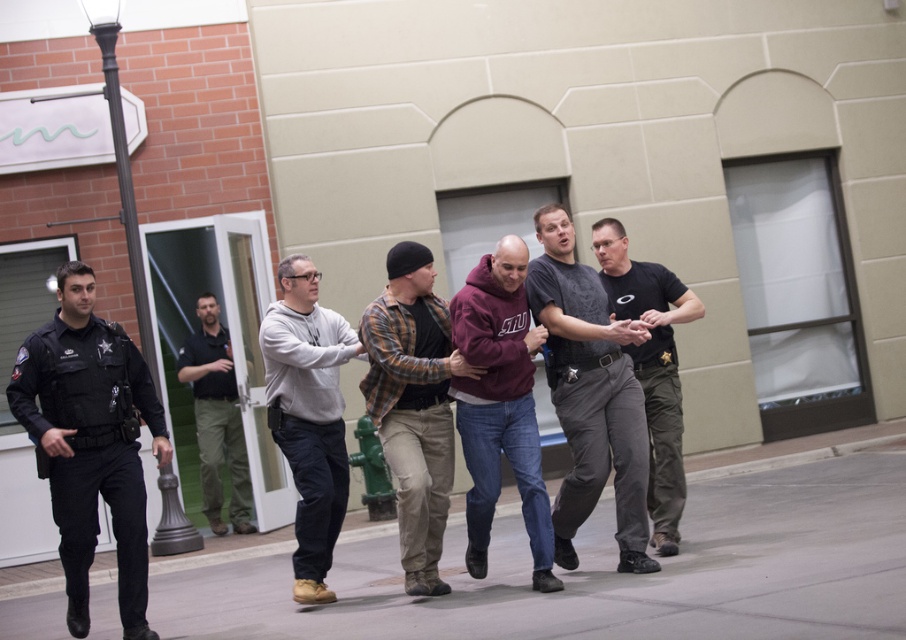
You are a security guard observing the scene outside the modern building. You notice the black uniformed officer at left and the black uniform pants at center. Which one is positioned lower in the image?

The black uniformed officer at left is located below black uniform pants at center, so the black uniformed officer at left is positioned lower in the image.

You are standing at the center of the scene. Which direction should you move to reach the black uniformed officer at left?

The black uniformed officer at left is located at point (90, 442), so you should move to the left to reach them.